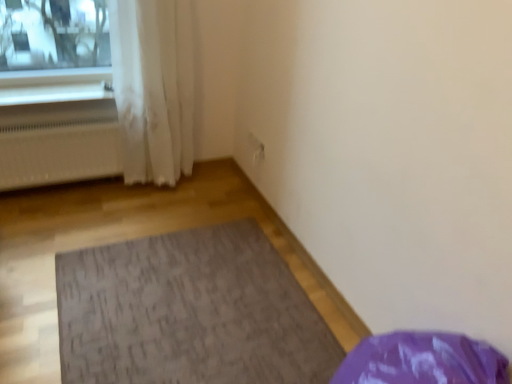
Identify the location of free area behind textured gray mat at center. (184, 201).